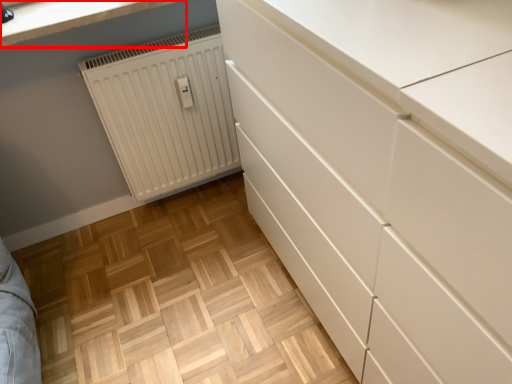
Question: From the image's perspective, what is the correct spatial relationship of countertop (annotated by the red box) in relation to radiator?

Choices:
 (A) below
 (B) above

Answer: (B)